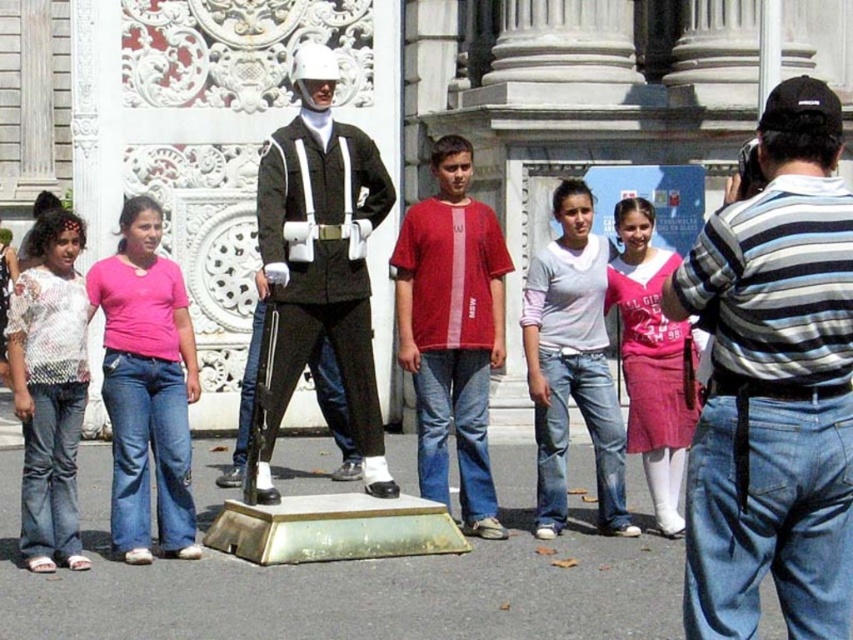
You are standing at the camera position and want to take a photo of the pink fabric shirt at left. The statue of the guard is between you and the shirt. Is the statue blocking your view of the shirt?

The statue of the guard is between you and the pink fabric shirt at left, but the distance between the shirt and the camera is 29.38 meters, so the statue is not blocking the view of the shirt.